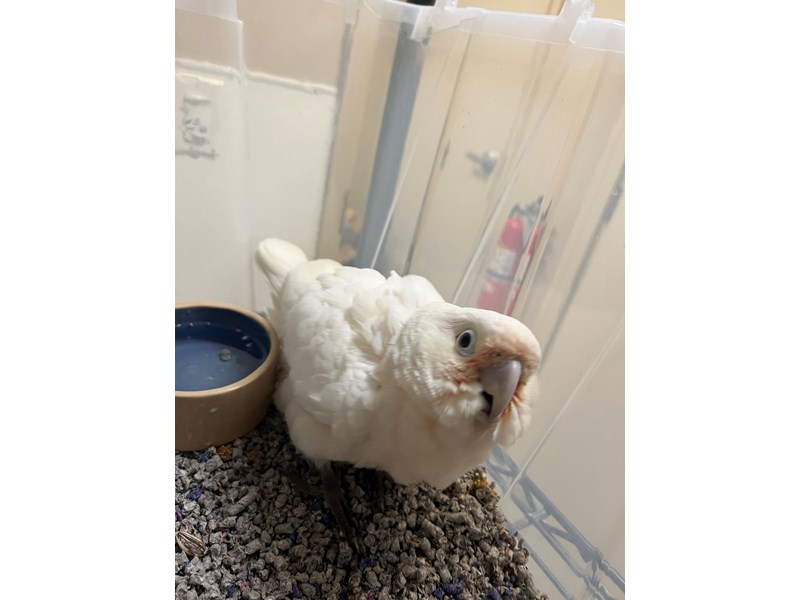
The image size is (800, 600). Find the location of `water dish`. water dish is located at coordinates (194, 378).